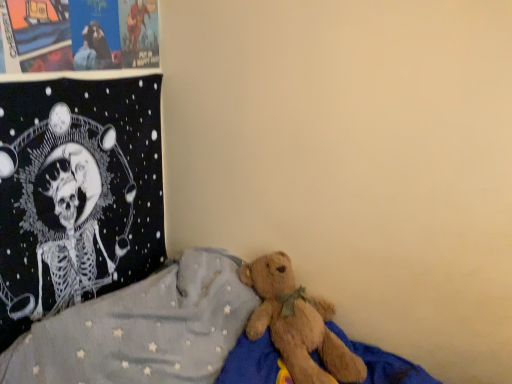
Question: Can you confirm if brown plush bear at lower right is bigger than matte paper posters at upper left?

Choices:
 (A) no
 (B) yes

Answer: (B)

Question: Is brown plush bear at lower right in contact with matte paper posters at upper left?

Choices:
 (A) yes
 (B) no

Answer: (B)

Question: Does brown plush bear at lower right turn towards matte paper posters at upper left?

Choices:
 (A) no
 (B) yes

Answer: (A)

Question: Is brown plush bear at lower right shorter than matte paper posters at upper left?

Choices:
 (A) no
 (B) yes

Answer: (A)

Question: Could matte paper posters at upper left be considered to be inside brown plush bear at lower right?

Choices:
 (A) no
 (B) yes

Answer: (A)

Question: Does brown plush bear at lower right come behind matte paper posters at upper left?

Choices:
 (A) no
 (B) yes

Answer: (A)

Question: From the image's perspective, does black fabric tapestry at upper left appear higher than matte paper posters at upper left?

Choices:
 (A) no
 (B) yes

Answer: (A)

Question: Does black fabric tapestry at upper left have a greater height compared to matte paper posters at upper left?

Choices:
 (A) no
 (B) yes

Answer: (B)

Question: Considering the relative sizes of black fabric tapestry at upper left and matte paper posters at upper left in the image provided, is black fabric tapestry at upper left wider than matte paper posters at upper left?

Choices:
 (A) no
 (B) yes

Answer: (B)

Question: From a real-world perspective, is black fabric tapestry at upper left on matte paper posters at upper left?

Choices:
 (A) yes
 (B) no

Answer: (B)

Question: Can you confirm if black fabric tapestry at upper left is smaller than matte paper posters at upper left?

Choices:
 (A) yes
 (B) no

Answer: (B)

Question: Is black fabric tapestry at upper left with matte paper posters at upper left?

Choices:
 (A) no
 (B) yes

Answer: (A)

Question: Is the surface of black fabric tapestry at upper left in direct contact with brown plush bear at lower right?

Choices:
 (A) no
 (B) yes

Answer: (A)